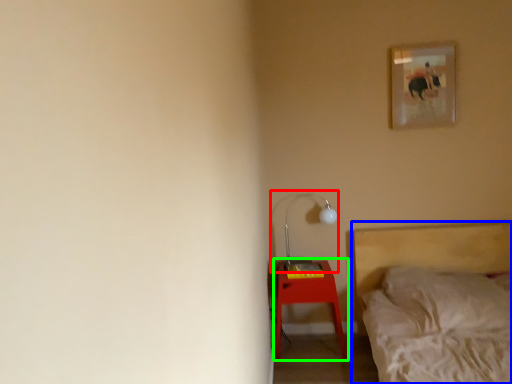
Question: Based on their relative distances, which object is nearer to table lamp (highlighted by a red box)? Choose from bed (highlighted by a blue box) and nightstand (highlighted by a green box).

Choices:
 (A) bed
 (B) nightstand

Answer: (B)